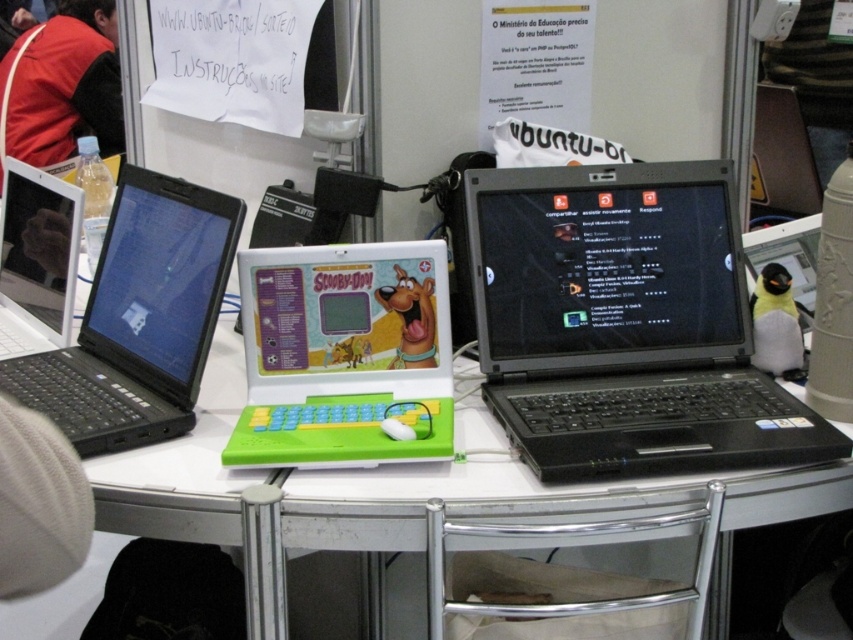
Does green plastic laptop at center appear on the left side of white plastic laptop at left?

No, green plastic laptop at center is not to the left of white plastic laptop at left.

Who is more distant from viewer, (x=276, y=296) or (x=35, y=198)?

The point (x=35, y=198) is behind.

Measure the distance between point (314, 307) and camera.

The distance of point (314, 307) from camera is 1.28 meters.

The width and height of the screenshot is (853, 640). I want to click on green plastic laptop at center, so click(343, 355).

Is white plastic table at center bigger than green plastic laptop at center?

Correct, white plastic table at center is larger in size than green plastic laptop at center.

What do you see at coordinates (409, 493) in the screenshot? I see `white plastic table at center` at bounding box center [409, 493].

You are a GUI agent. You are given a task and a screenshot of the screen. Output one action in this format:
    pyautogui.click(x=<x>, y=<y>)
    Task: Click on the white plastic table at center
    The height and width of the screenshot is (640, 853).
    Given the screenshot: What is the action you would take?
    pyautogui.click(x=409, y=493)

In the scene shown: Can you confirm if black plastic laptop at center is smaller than green plastic laptop at center?

Actually, black plastic laptop at center might be larger than green plastic laptop at center.

Who is higher up, black plastic laptop at center or green plastic laptop at center?

Positioned higher is black plastic laptop at center.

Between point (505, 433) and point (415, 426), which one is positioned in front?

Point (415, 426) is more forward.

The image size is (853, 640). I want to click on black plastic laptop at center, so click(625, 324).